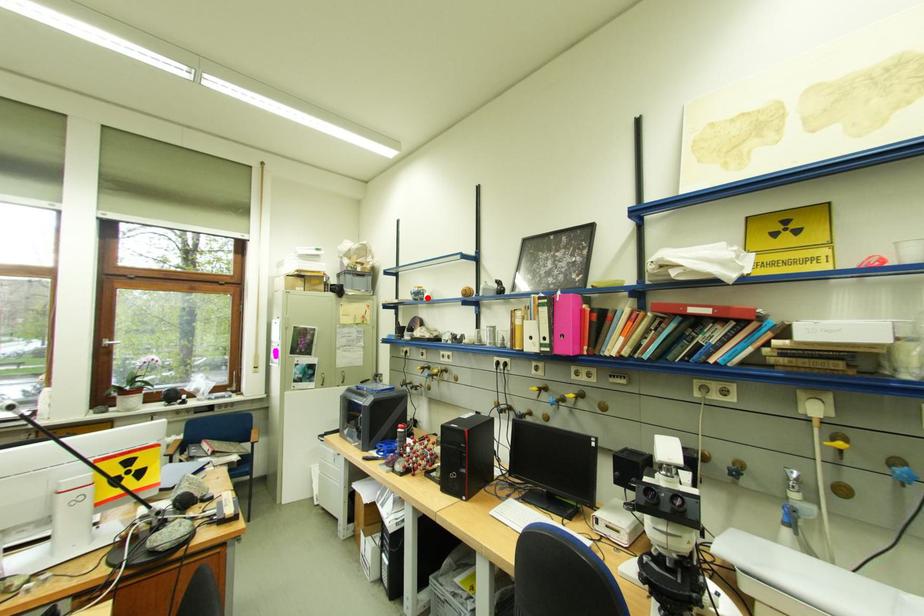
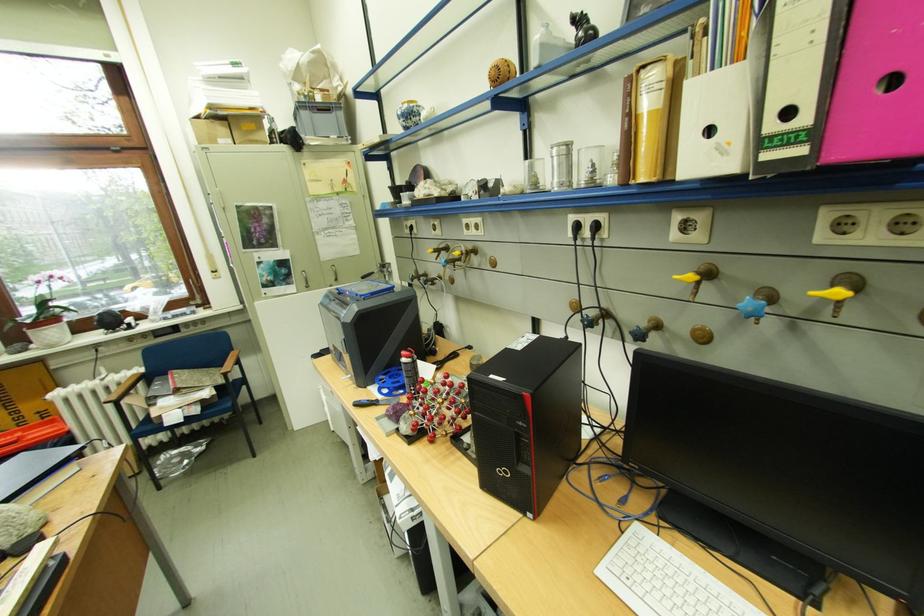
In the second image, find the point that corresponds to the highlighted location in the first image.

(419, 122)